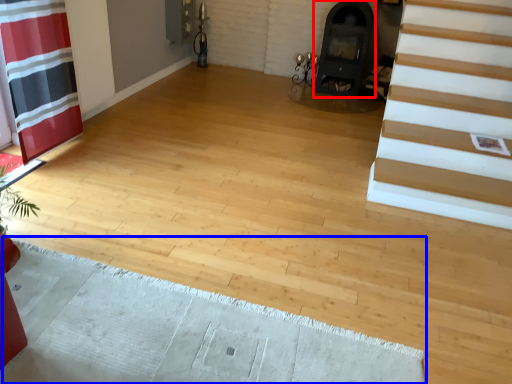
Question: Which object appears farthest to the camera in this image, fireplace (highlighted by a red box) or doormat (highlighted by a blue box)?

Choices:
 (A) fireplace
 (B) doormat

Answer: (A)